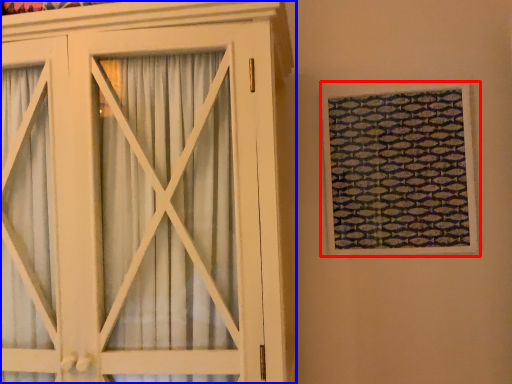
Question: Among these objects, which one is nearest to the camera, window (highlighted by a red box) or cupboard (highlighted by a blue box)?

Choices:
 (A) window
 (B) cupboard

Answer: (B)